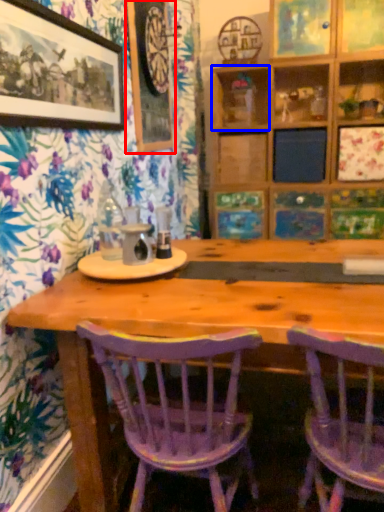
Question: Which object is further to the camera taking this photo, picture frame (highlighted by a red box) or shelf (highlighted by a blue box)?

Choices:
 (A) picture frame
 (B) shelf

Answer: (B)